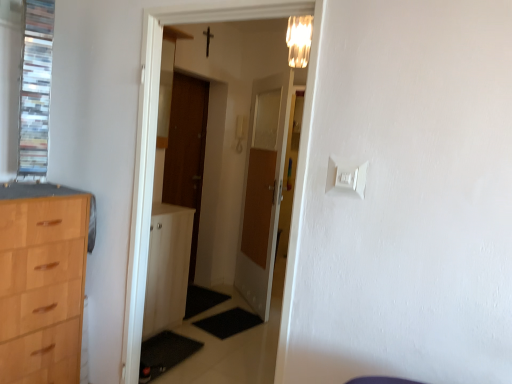
Question: Can you confirm if wooden door at center, the second door in the left-to-right sequence, is smaller than matte glass light fixture at upper center?

Choices:
 (A) no
 (B) yes

Answer: (A)

Question: Does wooden door at center, the second door in the left-to-right sequence, contain matte glass light fixture at upper center?

Choices:
 (A) no
 (B) yes

Answer: (A)

Question: From the image's perspective, is wooden door at center, the second door in the left-to-right sequence, on top of matte glass light fixture at upper center?

Choices:
 (A) no
 (B) yes

Answer: (A)

Question: Can you confirm if wooden door at center, the second door in the left-to-right sequence, is wider than matte glass light fixture at upper center?

Choices:
 (A) no
 (B) yes

Answer: (A)

Question: Is wooden door at center, which is the first door from right to left, far away from matte glass light fixture at upper center?

Choices:
 (A) yes
 (B) no

Answer: (B)

Question: Is matte glass light fixture at upper center bigger or smaller than metallic cross at upper center?

Choices:
 (A) small
 (B) big

Answer: (B)

Question: Do you think matte glass light fixture at upper center is within metallic cross at upper center, or outside of it?

Choices:
 (A) outside
 (B) inside

Answer: (A)

Question: From the image's perspective, is matte glass light fixture at upper center located above or below metallic cross at upper center?

Choices:
 (A) above
 (B) below

Answer: (B)

Question: Would you say matte glass light fixture at upper center is to the left or to the right of metallic cross at upper center in the picture?

Choices:
 (A) right
 (B) left

Answer: (A)

Question: From the image's perspective, is white plastic light switch at upper center above or below wooden door at center, the first door from the left?

Choices:
 (A) below
 (B) above

Answer: (A)

Question: Is white plastic light switch at upper center inside the boundaries of wooden door at center, the 2th door in the right-to-left sequence, or outside?

Choices:
 (A) outside
 (B) inside

Answer: (A)

Question: Looking at the image, does white plastic light switch at upper center seem bigger or smaller compared to wooden door at center, the 2th door in the right-to-left sequence?

Choices:
 (A) small
 (B) big

Answer: (A)

Question: In the image, is white plastic light switch at upper center positioned in front of or behind wooden door at center, the 2th door in the right-to-left sequence?

Choices:
 (A) behind
 (B) front

Answer: (B)

Question: In the image, is metallic cross at upper center positioned in front of or behind white plastic light switch at upper center?

Choices:
 (A) behind
 (B) front

Answer: (A)

Question: Is point (205, 56) positioned closer to the camera than point (330, 190)?

Choices:
 (A) closer
 (B) farther

Answer: (B)